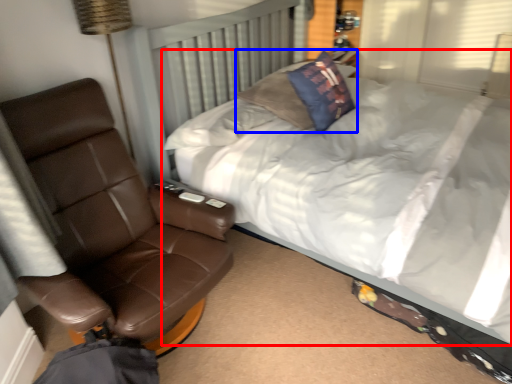
Question: Which object appears farthest to the camera in this image, bed (highlighted by a red box) or pillow (highlighted by a blue box)?

Choices:
 (A) bed
 (B) pillow

Answer: (B)